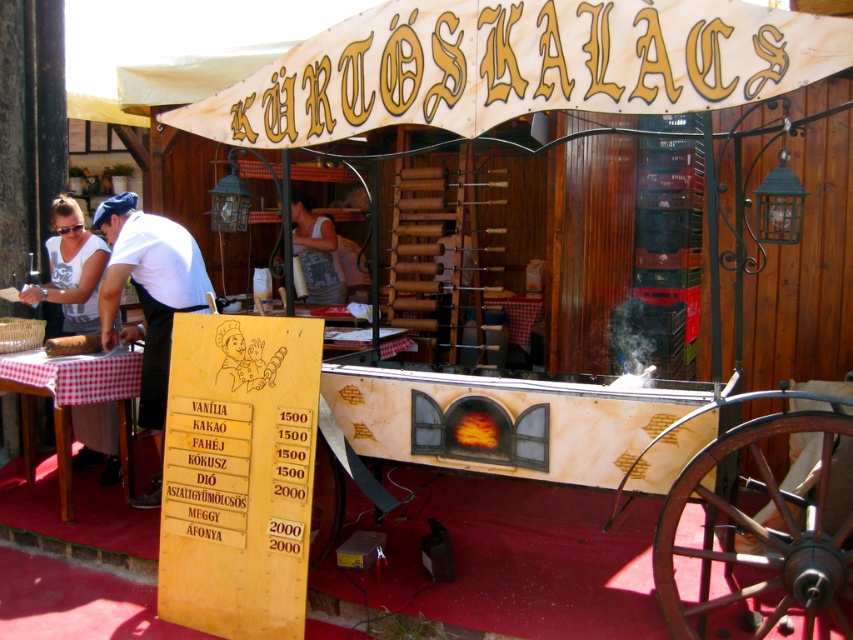
Question: Does white shirt at left appear over white fabric shirt at left?

Choices:
 (A) no
 (B) yes

Answer: (A)

Question: Is white fabric shirt at left to the right of white fabric apron at center from the viewer's perspective?

Choices:
 (A) yes
 (B) no

Answer: (B)

Question: Which point is farther from the camera taking this photo?

Choices:
 (A) (152, 486)
 (B) (67, 349)
 (C) (312, 256)
 (D) (96, 310)

Answer: (C)

Question: Which point is closer to the camera?

Choices:
 (A) (311, 236)
 (B) (62, 252)
 (C) (61, 353)
 (D) (177, 246)

Answer: (C)

Question: Is white fabric shirt at left thinner than white fabric apron at center?

Choices:
 (A) no
 (B) yes

Answer: (A)

Question: Based on their relative distances, which object is nearer to the white shirt at left?

Choices:
 (A) brown wood log at lower left
 (B) white fabric shirt at left
 (C) white fabric apron at center

Answer: (A)